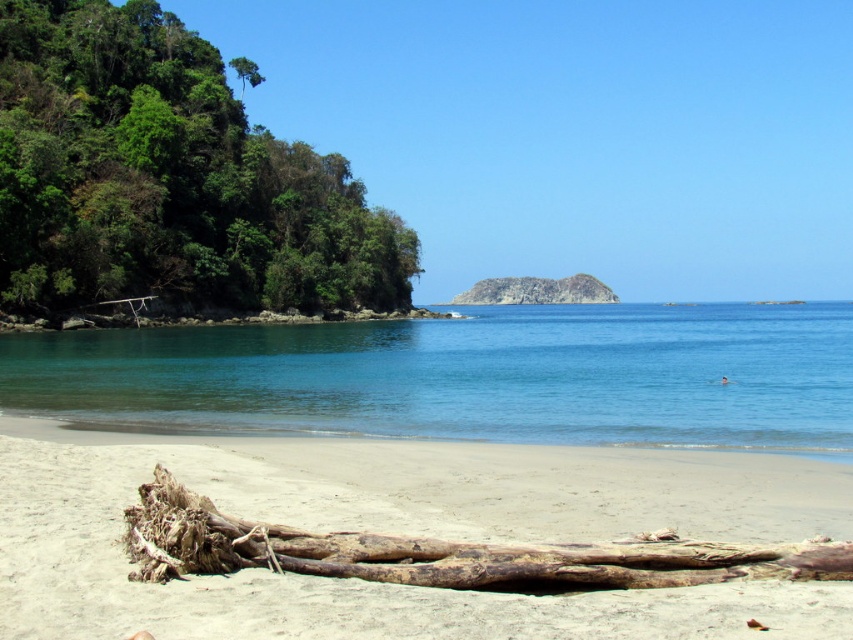
Who is lower down, light beige sand at lower center or clear blue water at center?

light beige sand at lower center is below.

Between light beige sand at lower center and clear blue water at center, which one appears on the right side from the viewer's perspective?

From the viewer's perspective, clear blue water at center appears more on the right side.

Image resolution: width=853 pixels, height=640 pixels. What do you see at coordinates (402, 532) in the screenshot?
I see `light beige sand at lower center` at bounding box center [402, 532].

Find the location of a particular element. The height and width of the screenshot is (640, 853). light beige sand at lower center is located at coordinates (402, 532).

Which is behind, point (643, 456) or point (572, 298)?

Positioned behind is point (572, 298).

Does light beige sand at lower center have a greater width compared to rusty rock at center?

In fact, light beige sand at lower center might be narrower than rusty rock at center.

Between point (357, 525) and point (596, 298), which one is positioned in front?

Point (357, 525) is in front.

This screenshot has height=640, width=853. I want to click on light beige sand at lower center, so click(x=402, y=532).

Does clear blue water at center appear under rusty rock at center?

Yes, clear blue water at center is below rusty rock at center.

Is point (463, 397) closer to viewer compared to point (454, 304)?

Yes, it is in front of point (454, 304).

The image size is (853, 640). What are the coordinates of `clear blue water at center` in the screenshot? It's located at (465, 376).